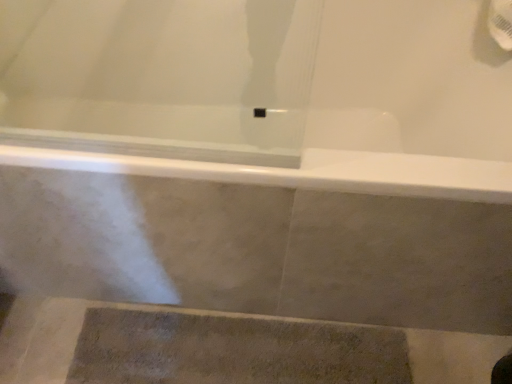
You are a GUI agent. You are given a task and a screenshot of the screen. Output one action in this format:
    pyautogui.click(x=<x>, y=<y>)
    Task: Click on the white glossy bathtub at upper center
    The width and height of the screenshot is (512, 384).
    Given the screenshot: What is the action you would take?
    pyautogui.click(x=379, y=110)

What is the approximate width of white glossy bathtub at upper center?

white glossy bathtub at upper center is 27.55 inches wide.

Describe the element at coordinates (379, 110) in the screenshot. I see `white glossy bathtub at upper center` at that location.

This screenshot has height=384, width=512. Find the location of `white glossy bathtub at upper center`. white glossy bathtub at upper center is located at coordinates (379, 110).